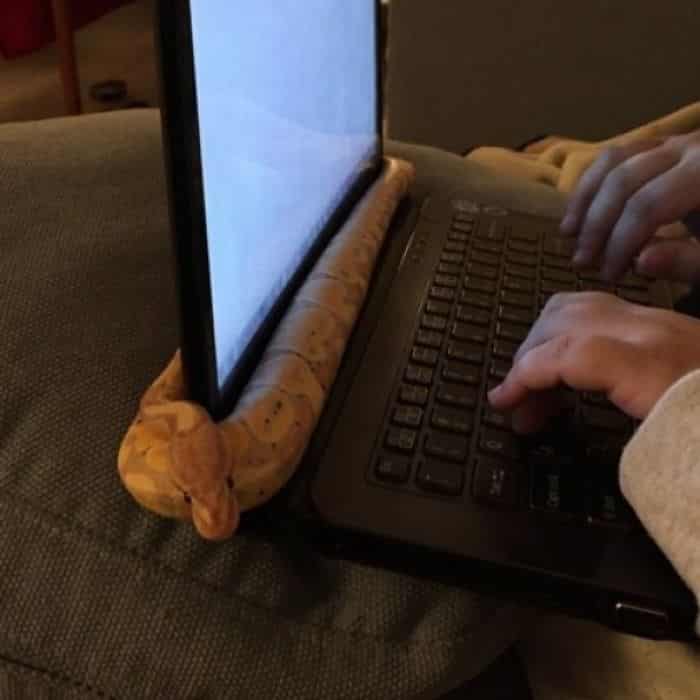
I want to click on screen, so click(x=257, y=168), click(x=322, y=62).